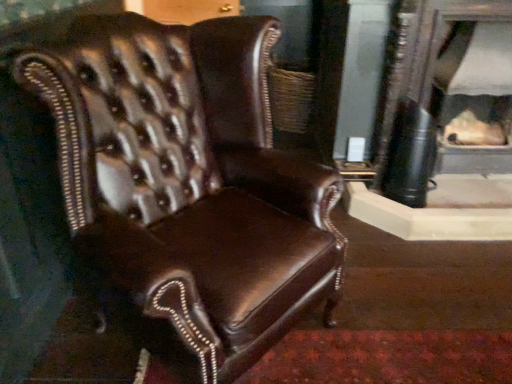
Question: Relative to brown leather chair at center, is matte black fireplace at center in front or behind?

Choices:
 (A) front
 (B) behind

Answer: (B)

Question: Looking at their shapes, would you say matte black fireplace at center is wider or thinner than brown leather chair at center?

Choices:
 (A) thin
 (B) wide

Answer: (A)

Question: From the image's perspective, is matte black fireplace at center located above or below brown leather chair at center?

Choices:
 (A) below
 (B) above

Answer: (B)

Question: Is brown leather chair at center situated inside matte black fireplace at center or outside?

Choices:
 (A) outside
 (B) inside

Answer: (A)

Question: Is point (226, 147) closer or farther from the camera than point (505, 109)?

Choices:
 (A) farther
 (B) closer

Answer: (B)

Question: Based on their sizes in the image, would you say brown leather chair at center is bigger or smaller than matte black fireplace at center?

Choices:
 (A) big
 (B) small

Answer: (A)

Question: From a real-world perspective, is brown leather chair at center physically located above or below matte black fireplace at center?

Choices:
 (A) above
 (B) below

Answer: (A)